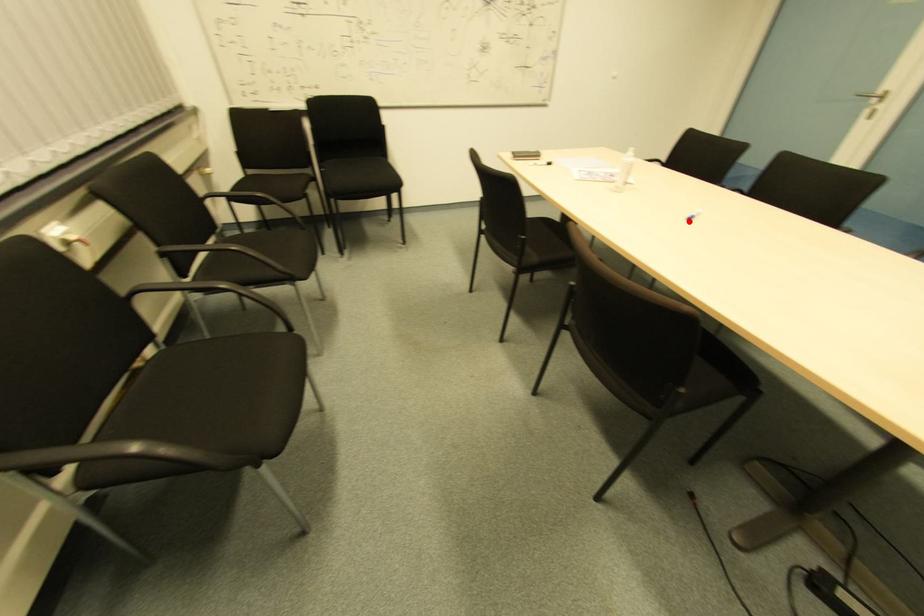
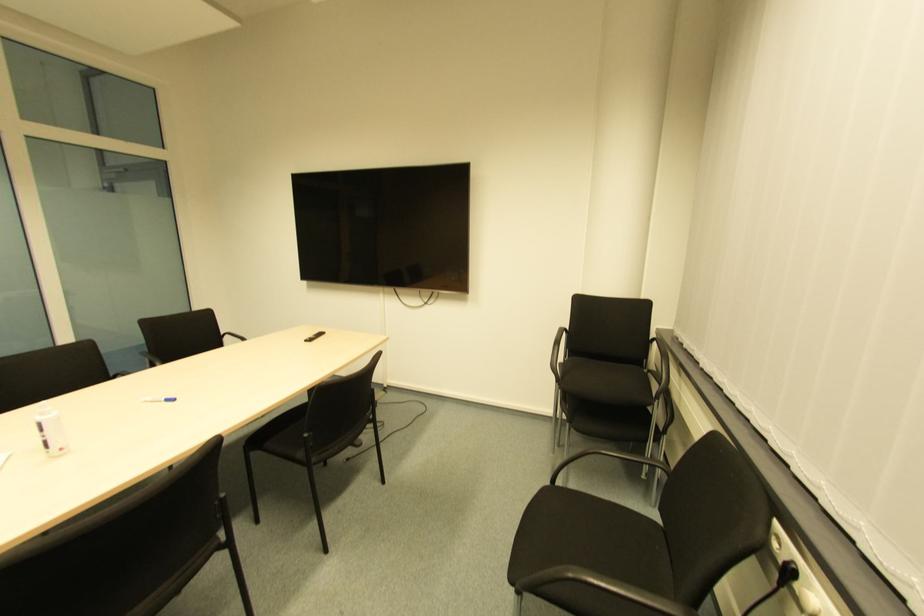
The point at the highlighted location is marked in the first image. Where is the corresponding point in the second image?

(172, 403)